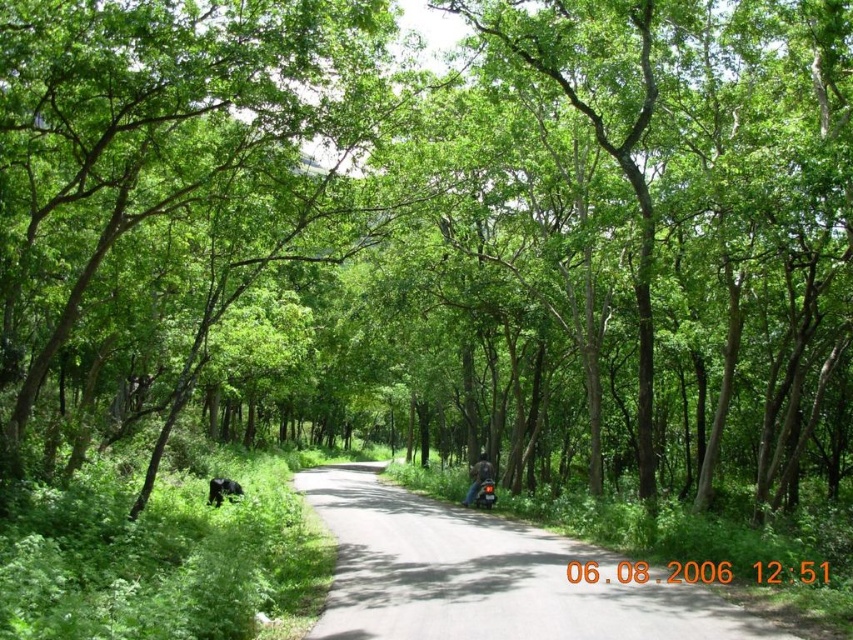
Can you confirm if asphalt road at center is positioned above shiny black motorcycle at center?

Yes, asphalt road at center is above shiny black motorcycle at center.

Can you confirm if asphalt road at center is thinner than shiny black motorcycle at center?

No.

Who is more forward, (374, 499) or (486, 492)?

Positioned in front is point (486, 492).

You are a GUI agent. You are given a task and a screenshot of the screen. Output one action in this format:
    pyautogui.click(x=<x>, y=<y>)
    Task: Click on the asphalt road at center
    Image resolution: width=853 pixels, height=640 pixels.
    Given the screenshot: What is the action you would take?
    pyautogui.click(x=486, y=576)

Does point (553, 605) come behind point (463, 504)?

No, (553, 605) is closer to viewer.

Does asphalt road at center have a larger size compared to leather jacket at center?

Yes, asphalt road at center is bigger than leather jacket at center.

Between point (601, 625) and point (480, 467), which one is positioned behind?

The point (480, 467) is behind.

Locate an element on the screen. The height and width of the screenshot is (640, 853). asphalt road at center is located at coordinates (486, 576).

Does leather jacket at center lie behind shiny black motorcycle at center?

Yes, it is.

Between point (476, 484) and point (490, 493), which one is positioned in front?

Positioned in front is point (490, 493).

Where is `leather jacket at center`? This screenshot has height=640, width=853. leather jacket at center is located at coordinates (479, 477).